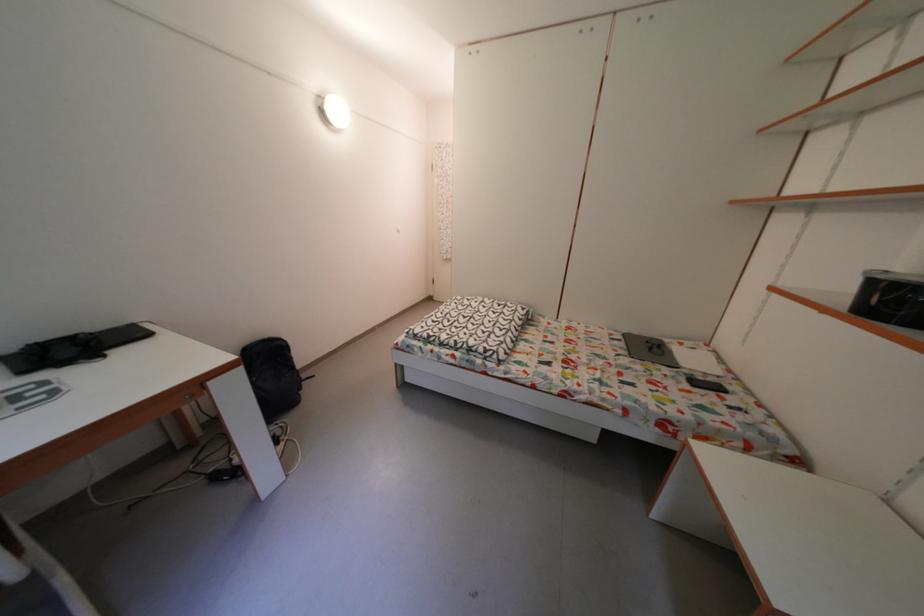
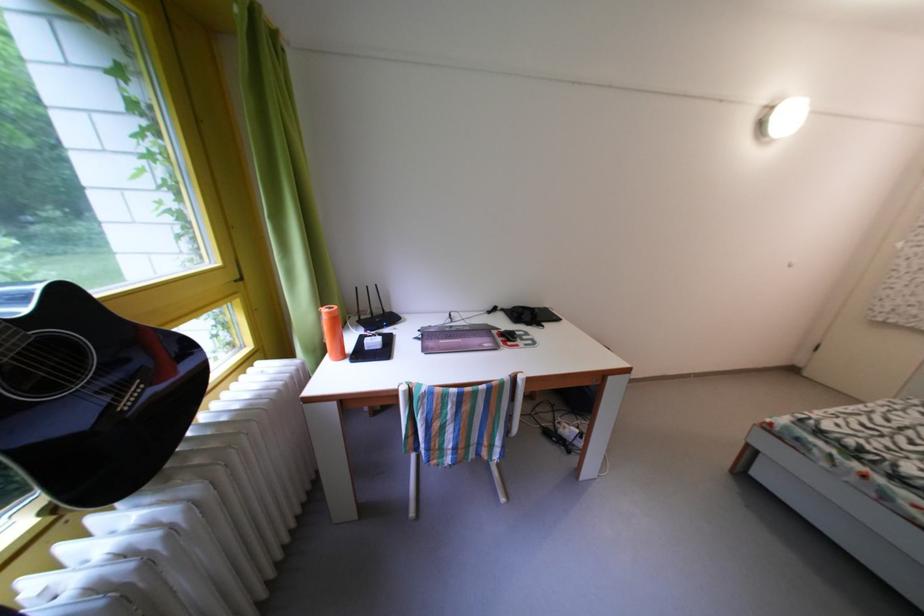
Question: The camera is either moving clockwise (left) or counter-clockwise (right) around the object. The first image is from the beginning of the video and the second image is from the end. Is the camera moving left or right when shooting the video?

Choices:
 (A) Left
 (B) Right

Answer: (B)